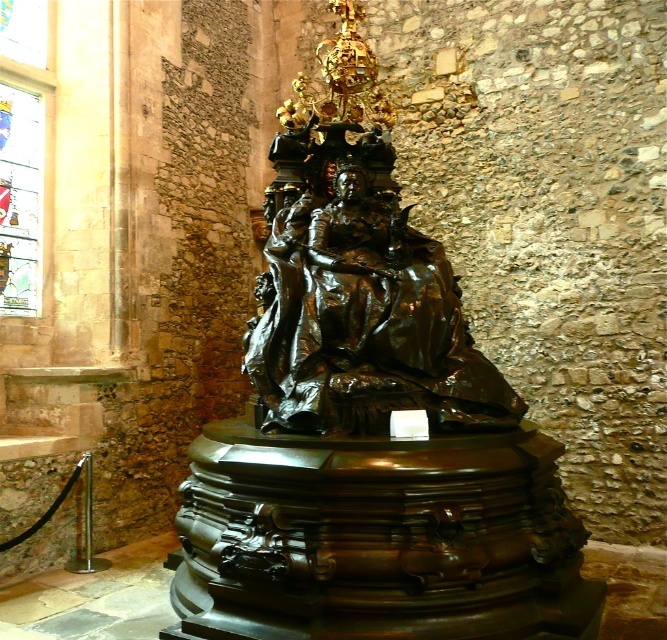
Question: Does bronze statue at center appear over shiny bronze statue at center?

Choices:
 (A) yes
 (B) no

Answer: (B)

Question: Can you confirm if bronze statue at center is positioned to the left of stained glass window at upper left?

Choices:
 (A) no
 (B) yes

Answer: (A)

Question: Is shiny bronze statue at center to the right of stained glass window at upper left from the viewer's perspective?

Choices:
 (A) no
 (B) yes

Answer: (B)

Question: Which of these objects is positioned farthest from the stained glass window at upper left?

Choices:
 (A) bronze statue at center
 (B) shiny bronze statue at center

Answer: (A)

Question: Estimate the real-world distances between objects in this image. Which object is closer to the stained glass window at upper left?

Choices:
 (A) shiny bronze statue at center
 (B) bronze statue at center

Answer: (A)

Question: Which point is closer to the camera?

Choices:
 (A) stained glass window at upper left
 (B) shiny bronze statue at center
 (C) bronze statue at center

Answer: (C)